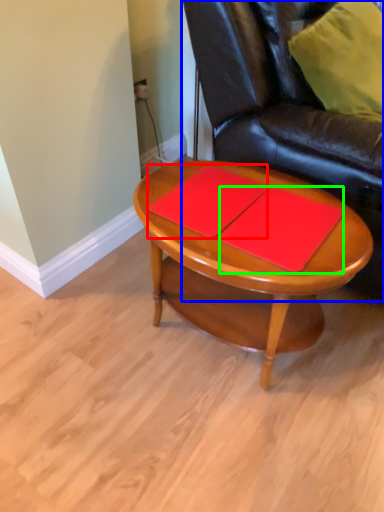
Question: Which object is the farthest from notebook (highlighted by a red box)? Choose among these: chair (highlighted by a blue box) or notebook (highlighted by a green box).

Choices:
 (A) chair
 (B) notebook

Answer: (A)